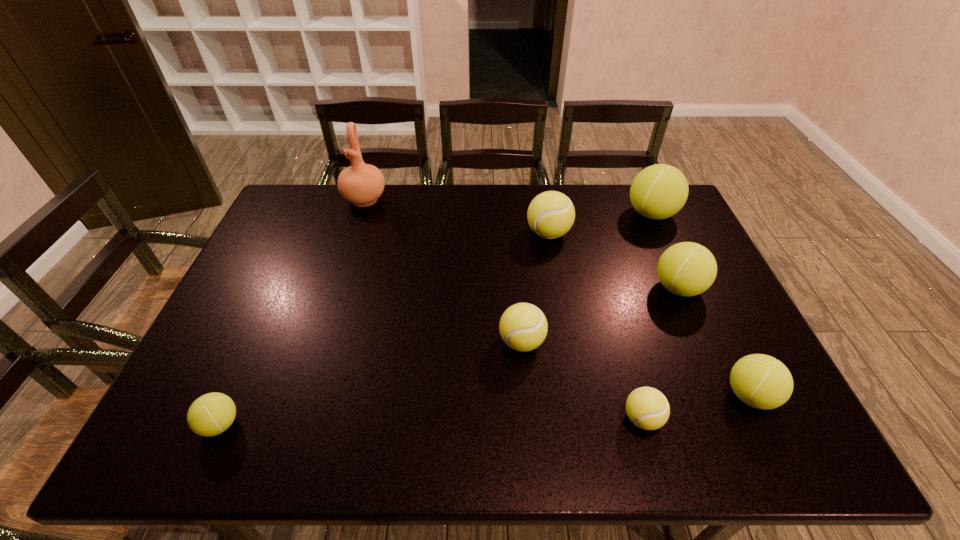
Where is `vacant area situated 0.290m on the right of the fifth object from left to right`? This screenshot has height=540, width=960. vacant area situated 0.290m on the right of the fifth object from left to right is located at coordinates (792, 418).

You are a GUI agent. You are given a task and a screenshot of the screen. Output one action in this format:
    pyautogui.click(x=<x>, y=<y>)
    Task: Click on the vacant space located on the right of the leftmost green tennis ball
    The width and height of the screenshot is (960, 540).
    Given the screenshot: What is the action you would take?
    pyautogui.click(x=295, y=424)

I want to click on pottery at the far edge, so 362,184.

The height and width of the screenshot is (540, 960). What are the coordinates of `object at the left edge` in the screenshot? It's located at (211, 414).

At what (x,y) coordinates should I click in order to perform the action: click on object situated at the near left corner. Please return your answer as a coordinate pair (x, y). Looking at the image, I should click on 211,414.

Where is `object that is at the far right corner`? object that is at the far right corner is located at coordinates (659, 191).

This screenshot has height=540, width=960. Find the location of `object at the near right corner`. object at the near right corner is located at coordinates (760, 381).

The width and height of the screenshot is (960, 540). Identify the location of free space at the far edge. (627, 219).

Locate an element on the screen. The height and width of the screenshot is (540, 960). free space at the near edge of the desktop is located at coordinates (501, 424).

This screenshot has width=960, height=540. In order to click on vacant region at the left edge of the desktop in this screenshot , I will do `click(302, 227)`.